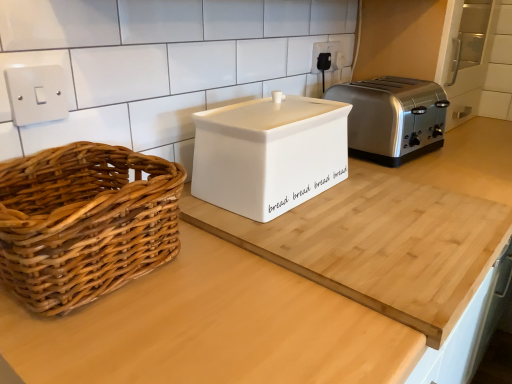
Locate an element on the screen. The width and height of the screenshot is (512, 384). empty space that is to the right of woven wood picnic basket at left is located at coordinates (246, 275).